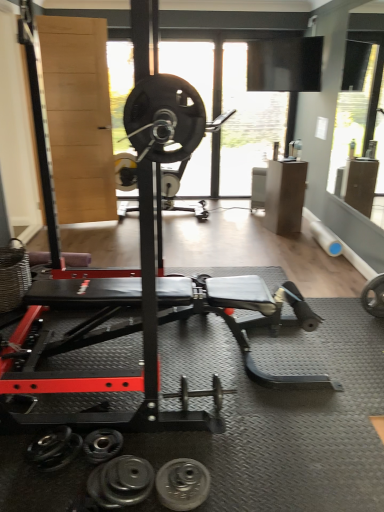
Image resolution: width=384 pixels, height=512 pixels. Find the location of `free location in front of silver metallic dumbbell at center, the third dumbbell in the front-to-back sequence`. free location in front of silver metallic dumbbell at center, the third dumbbell in the front-to-back sequence is located at coordinates (219, 448).